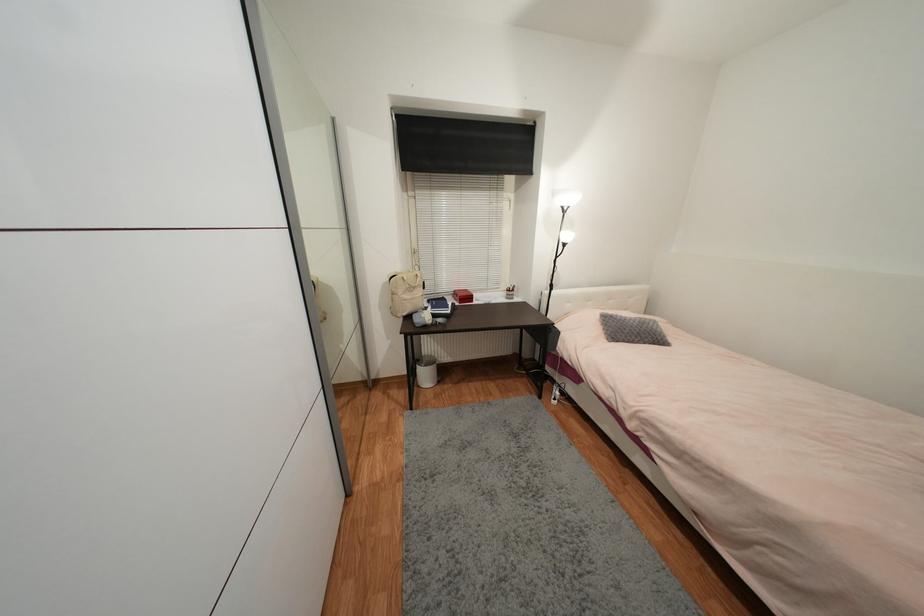
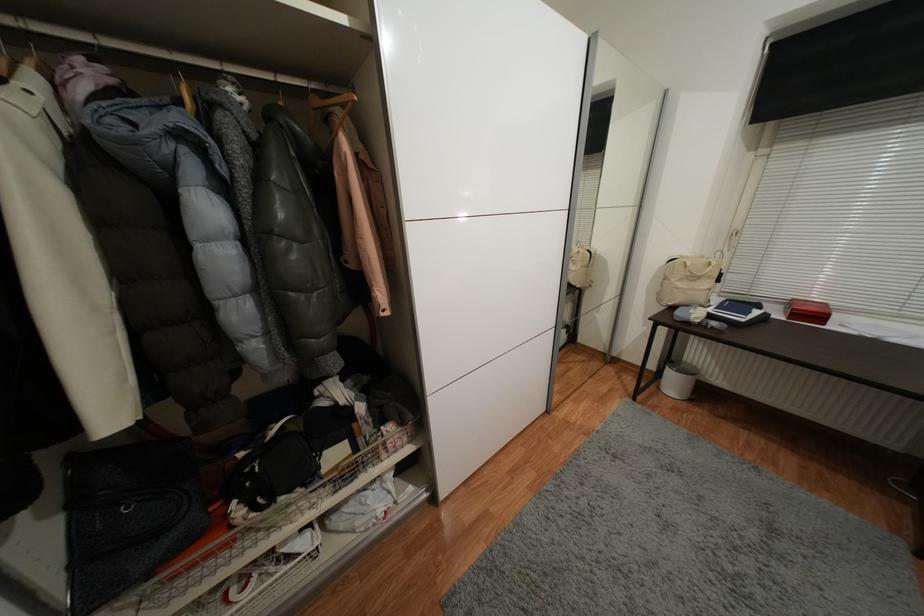
The point at (412, 273) is marked in the first image. Where is the corresponding point in the second image?

(707, 257)